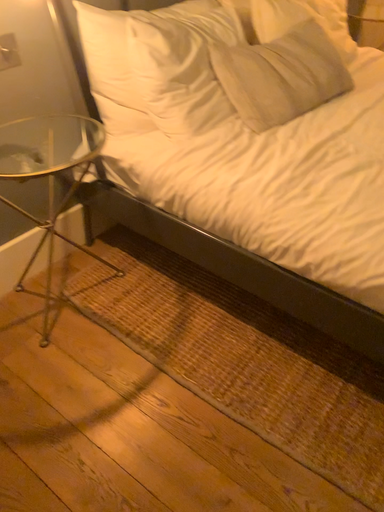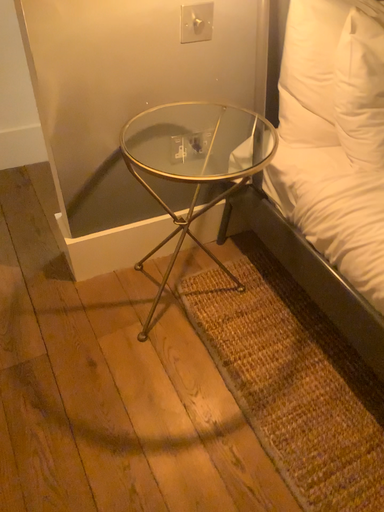
Question: Which way did the camera rotate in the video?

Choices:
 (A) rotated right
 (B) rotated left

Answer: (B)